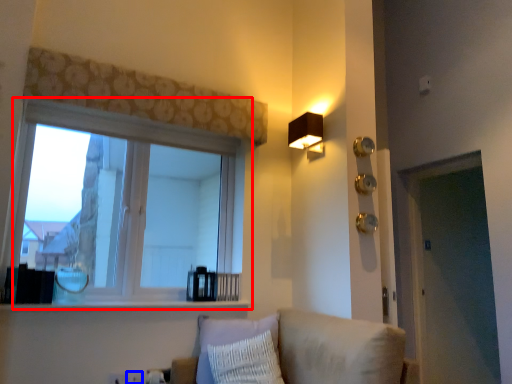
Question: Which object is closer to the camera taking this photo, window (highlighted by a red box) or electric outlet (highlighted by a blue box)?

Choices:
 (A) window
 (B) electric outlet

Answer: (A)